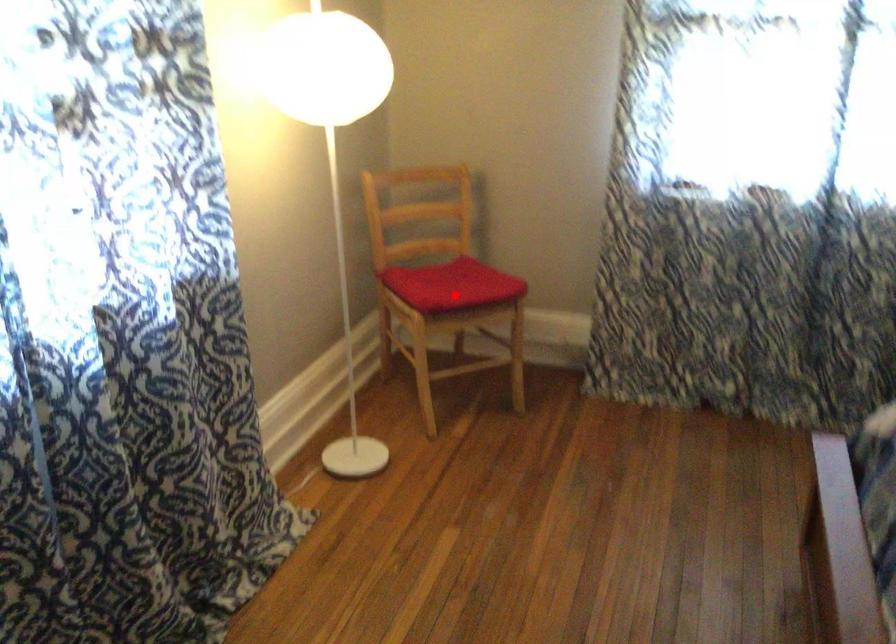
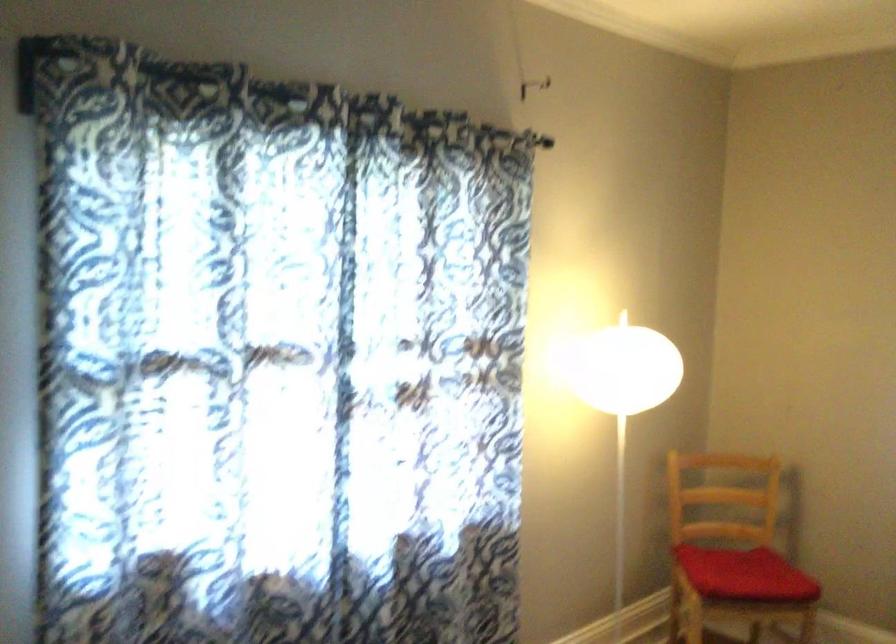
Find the pixel in the second image that matches the highlighted location in the first image.

(745, 574)